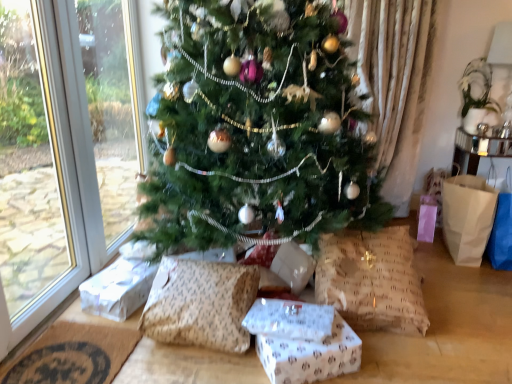
Describe the element at coordinates (310, 355) in the screenshot. Image resolution: width=512 pixels, height=384 pixels. I see `white paper gift at center, acting as the first gift box starting from the front` at that location.

What is the approximate width of burlap pillow at lower right, placed as the first pillow when sorted from right to left?

It is 22.44 inches.

What do you see at coordinates (200, 304) in the screenshot?
I see `brown textured pillow at lower center, which appears as the second pillow when viewed from the right` at bounding box center [200, 304].

Locate an element on the screen. This screenshot has width=512, height=384. brown paper bag at right is located at coordinates (467, 217).

Which is closer to the camera, (113, 374) or (293, 363)?

Point (113, 374) appears to be farther away from the viewer than point (293, 363).

From a real-world perspective, between brown woven mat at lower left and white paper gift at center, acting as the first gift box starting from the front, who is vertically higher?

white paper gift at center, acting as the first gift box starting from the front.

Considering the positions of objects brown woven mat at lower left and white paper gift at center, acting as the first gift box starting from the front, in the image provided, who is behind, brown woven mat at lower left or white paper gift at center, acting as the first gift box starting from the front,?

brown woven mat at lower left.

Is brown woven mat at lower left oriented towards white paper gift at center, acting as the first gift box starting from the front?

Yes, brown woven mat at lower left faces towards white paper gift at center, acting as the first gift box starting from the front.

Is burlap pillow at lower right, marked as the 2th pillow in a left-to-right arrangement, facing towards green matte christmas tree at center?

Yes, burlap pillow at lower right, marked as the 2th pillow in a left-to-right arrangement, is turned towards green matte christmas tree at center.

Between point (393, 253) and point (255, 30), which one is positioned in front?

The point (255, 30) is in front.

Is burlap pillow at lower right, marked as the 2th pillow in a left-to-right arrangement, shorter than green matte christmas tree at center?

Indeed, burlap pillow at lower right, marked as the 2th pillow in a left-to-right arrangement, has a lesser height compared to green matte christmas tree at center.

Which object is further away from the camera, burlap pillow at lower right, placed as the first pillow when sorted from right to left, or green matte christmas tree at center?

Positioned behind is burlap pillow at lower right, placed as the first pillow when sorted from right to left.

Is burlap pillow at lower right, marked as the 2th pillow in a left-to-right arrangement, inside or outside of white paper gift at center, acting as the first gift box starting from the front?

burlap pillow at lower right, marked as the 2th pillow in a left-to-right arrangement, is outside white paper gift at center, acting as the first gift box starting from the front.

From the image's perspective, count 2nd gift boxs downward from the burlap pillow at lower right, marked as the 2th pillow in a left-to-right arrangement, and point to it. Please provide its 2D coordinates.

[(310, 355)]

Is burlap pillow at lower right, placed as the first pillow when sorted from right to left, not close to white paper gift at center, placed as the first gift box when sorted from right to left?

They are positioned close to each other.

From the image's perspective, which is above, burlap pillow at lower right, marked as the 2th pillow in a left-to-right arrangement, or white paper gift at center, placed as the first gift box when sorted from right to left?

burlap pillow at lower right, marked as the 2th pillow in a left-to-right arrangement, appears higher in the image.

This screenshot has height=384, width=512. I want to click on the 2nd pillow located above the brown woven mat at lower left (from a real-world perspective), so click(372, 280).

From the image's perspective, is brown woven mat at lower left above or below burlap pillow at lower right, marked as the 2th pillow in a left-to-right arrangement?

brown woven mat at lower left is below burlap pillow at lower right, marked as the 2th pillow in a left-to-right arrangement.

Considering the sizes of objects brown woven mat at lower left and burlap pillow at lower right, marked as the 2th pillow in a left-to-right arrangement, in the image provided, who is shorter, brown woven mat at lower left or burlap pillow at lower right, marked as the 2th pillow in a left-to-right arrangement,?

Standing shorter between the two is brown woven mat at lower left.

Considering the positions of objects brown woven mat at lower left and burlap pillow at lower right, marked as the 2th pillow in a left-to-right arrangement, in the image provided, who is more to the left, brown woven mat at lower left or burlap pillow at lower right, marked as the 2th pillow in a left-to-right arrangement,?

brown woven mat at lower left.

Considering the relative sizes of green matte christmas tree at center and white paper gift at center, placed as the first gift box when sorted from right to left, in the image provided, is green matte christmas tree at center bigger than white paper gift at center, placed as the first gift box when sorted from right to left,?

Yes, green matte christmas tree at center is bigger than white paper gift at center, placed as the first gift box when sorted from right to left.

From the image's perspective, is green matte christmas tree at center located above white paper gift at center, which appears as the 2th gift box when viewed from the back?

Yes.

Is green matte christmas tree at center positioned behind white paper gift at center, which is counted as the 2th gift box, starting from the left?

No, green matte christmas tree at center is closer to the viewer.

Would you say brown textured pillow at lower center, marked as the first pillow in a left-to-right arrangement, is inside or outside white paper gift at lower left, placed as the second gift box when sorted from front to back?

brown textured pillow at lower center, marked as the first pillow in a left-to-right arrangement, exists outside the volume of white paper gift at lower left, placed as the second gift box when sorted from front to back.

Considering the sizes of objects brown textured pillow at lower center, which appears as the second pillow when viewed from the right, and white paper gift at lower left, placed as the second gift box when sorted from front to back, in the image provided, who is thinner, brown textured pillow at lower center, which appears as the second pillow when viewed from the right, or white paper gift at lower left, placed as the second gift box when sorted from front to back,?

brown textured pillow at lower center, which appears as the second pillow when viewed from the right, is thinner.

From a real-world perspective, does brown textured pillow at lower center, which appears as the second pillow when viewed from the right, sit lower than white paper gift at lower left, placed as the second gift box when sorted from front to back?

Actually, brown textured pillow at lower center, which appears as the second pillow when viewed from the right, is physically above white paper gift at lower left, placed as the second gift box when sorted from front to back, in the real world.

Can you confirm if green matte christmas tree at center is positioned to the left of white paper gift at lower left, placed as the second gift box when sorted from front to back?

In fact, green matte christmas tree at center is to the right of white paper gift at lower left, placed as the second gift box when sorted from front to back.

Which of these two, green matte christmas tree at center or white paper gift at lower left, marked as the second gift box in a right-to-left arrangement, stands taller?

green matte christmas tree at center is taller.

Is green matte christmas tree at center facing away from white paper gift at lower left, which ranks as the first gift box in left-to-right order?

Correct, green matte christmas tree at center is looking away from white paper gift at lower left, which ranks as the first gift box in left-to-right order.

Locate an element on the screen. This screenshot has width=512, height=384. the 2nd gift box to the right when counting from the brown woven mat at lower left is located at coordinates (310, 355).

Find the location of `christmas tree lying above the burlap pillow at lower right, placed as the first pillow when sorted from right to left (from the image's perspective)`. christmas tree lying above the burlap pillow at lower right, placed as the first pillow when sorted from right to left (from the image's perspective) is located at coordinates (257, 127).

Based on their spatial positions, is green matte christmas tree at center or brown paper bag at right further from brown woven mat at lower left?

Based on the image, brown paper bag at right appears to be further to brown woven mat at lower left.

Consider the image. Looking at the image, which one is located closer to green matte christmas tree at center, brown textured pillow at lower center, marked as the first pillow in a left-to-right arrangement, or brown woven mat at lower left?

The object closer to green matte christmas tree at center is brown textured pillow at lower center, marked as the first pillow in a left-to-right arrangement.

Which object lies nearer to the anchor point green matte christmas tree at center, brown woven mat at lower left or brown textured pillow at lower center, which appears as the second pillow when viewed from the right?

Among the two, brown textured pillow at lower center, which appears as the second pillow when viewed from the right, is located nearer to green matte christmas tree at center.

Which object lies further to the anchor point brown paper bag at right, white paper gift at center, which is counted as the 2th gift box, starting from the left, or white paper gift at lower left, which ranks as the first gift box in left-to-right order?

Among the two, white paper gift at lower left, which ranks as the first gift box in left-to-right order, is located further to brown paper bag at right.

From the image, which object appears to be farther from white paper gift at center, acting as the first gift box starting from the front, brown paper bag at right or white paper gift at lower left, marked as the second gift box in a right-to-left arrangement?

Among the two, brown paper bag at right is located further to white paper gift at center, acting as the first gift box starting from the front.

Looking at the image, which one is located closer to brown textured pillow at lower center, marked as the first pillow in a left-to-right arrangement, burlap pillow at lower right, marked as the 2th pillow in a left-to-right arrangement, or white paper gift at lower left, placed as the second gift box when sorted from front to back?

Based on the image, white paper gift at lower left, placed as the second gift box when sorted from front to back, appears to be nearer to brown textured pillow at lower center, marked as the first pillow in a left-to-right arrangement.

From the image, which object appears to be farther from brown woven mat at lower left, white paper gift at center, which appears as the 2th gift box when viewed from the back, or green matte christmas tree at center?

green matte christmas tree at center is further to brown woven mat at lower left.

Looking at the image, which one is located closer to burlap pillow at lower right, marked as the 2th pillow in a left-to-right arrangement, brown paper bag at right or green matte christmas tree at center?

green matte christmas tree at center lies closer to burlap pillow at lower right, marked as the 2th pillow in a left-to-right arrangement, than the other object.

At what (x,y) coordinates should I click in order to perform the action: click on christmas tree between white paper gift at lower left, marked as the second gift box in a right-to-left arrangement, and white paper gift at center, which is counted as the 2th gift box, starting from the left, in the horizontal direction. Please return your answer as a coordinate pair (x, y). This screenshot has width=512, height=384. Looking at the image, I should click on (257, 127).

You are a GUI agent. You are given a task and a screenshot of the screen. Output one action in this format:
    pyautogui.click(x=<x>, y=<y>)
    Task: Click on the pillow situated between brown textured pillow at lower center, marked as the first pillow in a left-to-right arrangement, and brown paper bag at right from left to right
    
    Given the screenshot: What is the action you would take?
    pyautogui.click(x=372, y=280)

Locate an element on the screen. Image resolution: width=512 pixels, height=384 pixels. christmas tree between brown textured pillow at lower center, which appears as the second pillow when viewed from the right, and burlap pillow at lower right, placed as the first pillow when sorted from right to left, from left to right is located at coordinates (257, 127).

Image resolution: width=512 pixels, height=384 pixels. Find the location of `christmas tree between white paper gift at lower left, placed as the second gift box when sorted from front to back, and burlap pillow at lower right, placed as the first pillow when sorted from right to left, in the horizontal direction`. christmas tree between white paper gift at lower left, placed as the second gift box when sorted from front to back, and burlap pillow at lower right, placed as the first pillow when sorted from right to left, in the horizontal direction is located at coordinates (257, 127).